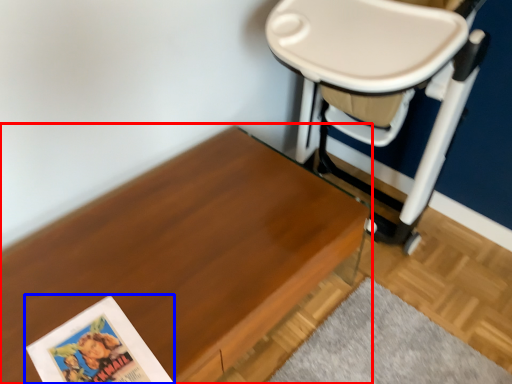
Question: Which point is closer to the camera, table (highlighted by a red box) or paperback book (highlighted by a blue box)?

Choices:
 (A) table
 (B) paperback book

Answer: (A)